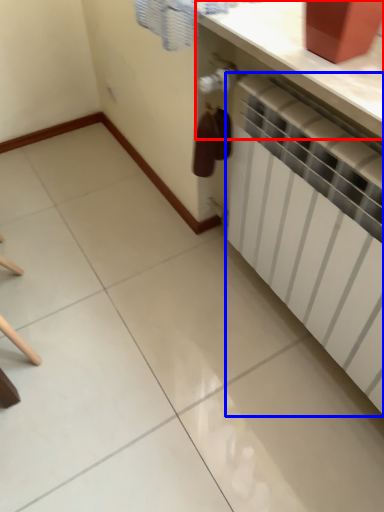
Question: Which of the following is the closest to the observer, counter top (highlighted by a red box) or radiator (highlighted by a blue box)?

Choices:
 (A) counter top
 (B) radiator

Answer: (B)